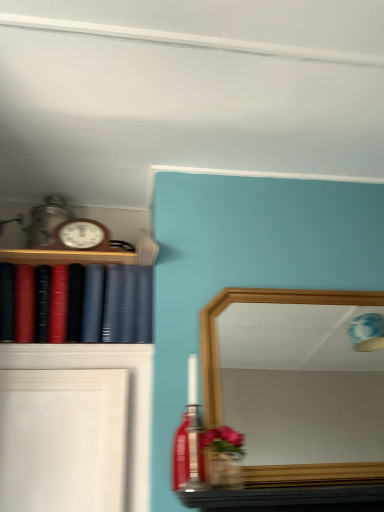
You are a GUI agent. You are given a task and a screenshot of the screen. Output one action in this format:
    pyautogui.click(x=<x>, y=<y>)
    Task: Click on the matte black books at left
    The width and height of the screenshot is (384, 512).
    Given the screenshot: What is the action you would take?
    pyautogui.click(x=75, y=297)

What do you see at coordinates (75, 297) in the screenshot? The height and width of the screenshot is (512, 384). I see `matte black books at left` at bounding box center [75, 297].

I want to click on matte black books at left, so click(75, 297).